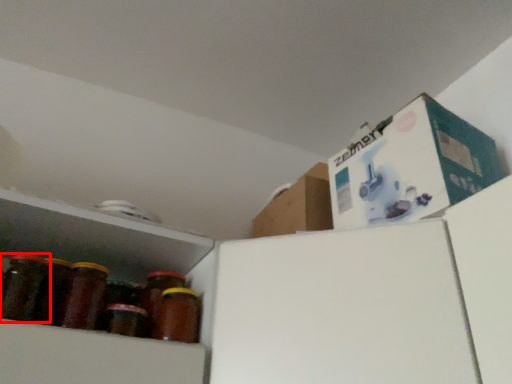
Question: In this image, where is bottle (annotated by the red box) located relative to bottle?

Choices:
 (A) left
 (B) right

Answer: (A)